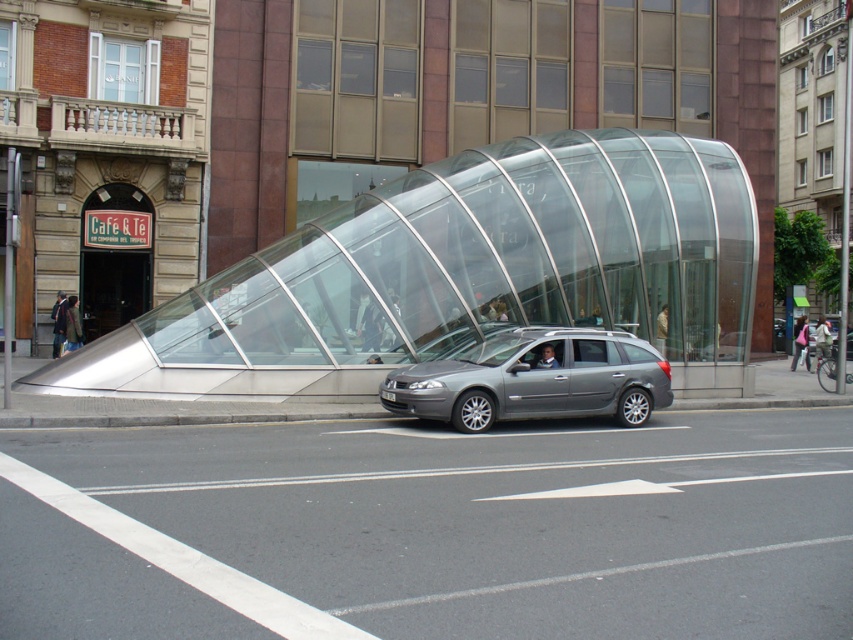
Is metallic silver car at center to the left of metallic gray station wagon at center from the viewer's perspective?

Yes, metallic silver car at center is to the left of metallic gray station wagon at center.

Is point (706, 145) behind point (531, 388)?

Yes, point (706, 145) is behind point (531, 388).

Locate an element on the screen. metallic silver car at center is located at coordinates (463, 275).

This screenshot has width=853, height=640. I want to click on metallic silver car at center, so click(x=463, y=275).

Is point (718, 628) more distant than point (619, 362)?

No, (718, 628) is closer to viewer.

Which is below, silver metallic car at center or metallic gray station wagon at center?

Positioned lower is silver metallic car at center.

Where is `silver metallic car at center`? This screenshot has height=640, width=853. silver metallic car at center is located at coordinates (505, 518).

Is point (589, 548) farther from camera compared to point (369, 284)?

No, it is not.

The width and height of the screenshot is (853, 640). In order to click on silver metallic car at center in this screenshot , I will do `click(505, 518)`.